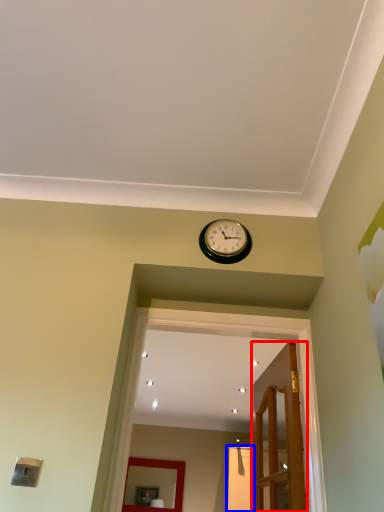
Question: Which point is closer to the camera, door (highlighted by a red box) or glass door (highlighted by a blue box)?

Choices:
 (A) door
 (B) glass door

Answer: (A)